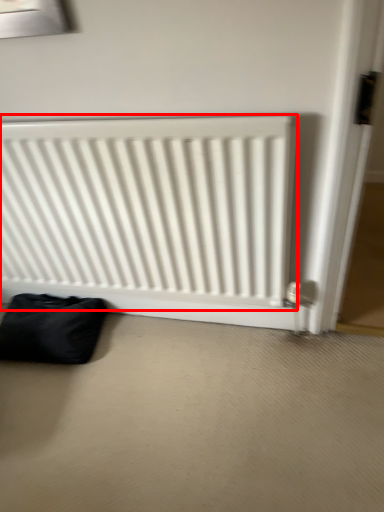
Question: From the image's perspective, considering the relative positions of radiator (annotated by the red box) and furniture in the image provided, where is radiator (annotated by the red box) located with respect to the staircase?

Choices:
 (A) below
 (B) above

Answer: (B)